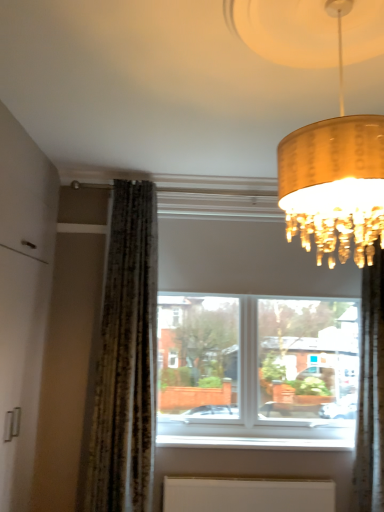
Question: Can you confirm if gold textured lampshade at upper right is taller than white matte radiator at lower center?

Choices:
 (A) yes
 (B) no

Answer: (A)

Question: Can we say gold textured lampshade at upper right lies outside white matte radiator at lower center?

Choices:
 (A) no
 (B) yes

Answer: (B)

Question: Considering the relative positions of gold textured lampshade at upper right and white matte radiator at lower center in the image provided, is gold textured lampshade at upper right to the right of white matte radiator at lower center from the viewer's perspective?

Choices:
 (A) no
 (B) yes

Answer: (A)

Question: Can you confirm if gold textured lampshade at upper right is shorter than white matte radiator at lower center?

Choices:
 (A) yes
 (B) no

Answer: (B)

Question: Does gold textured lampshade at upper right turn towards white matte radiator at lower center?

Choices:
 (A) no
 (B) yes

Answer: (A)

Question: Considering their positions, is white matte radiator at lower center located in front of or behind white smooth window sill at lower center?

Choices:
 (A) behind
 (B) front

Answer: (B)

Question: Which is correct: white matte radiator at lower center is inside white smooth window sill at lower center, or outside of it?

Choices:
 (A) inside
 (B) outside

Answer: (B)

Question: Is point pos(208,482) positioned closer to the camera than point pos(173,436)?

Choices:
 (A) farther
 (B) closer

Answer: (B)

Question: Is white matte radiator at lower center taller or shorter than white smooth window sill at lower center?

Choices:
 (A) short
 (B) tall

Answer: (B)

Question: In the image, is silky green curtain at right positioned in front of or behind transparent glass window at center?

Choices:
 (A) front
 (B) behind

Answer: (A)

Question: Is point (350, 499) positioned closer to the camera than point (238, 312)?

Choices:
 (A) farther
 (B) closer

Answer: (B)

Question: From the image's perspective, is silky green curtain at right positioned above or below transparent glass window at center?

Choices:
 (A) above
 (B) below

Answer: (B)

Question: From a real-world perspective, is silky green curtain at right above or below transparent glass window at center?

Choices:
 (A) below
 (B) above

Answer: (A)

Question: Which is correct: gold textured lampshade at upper right is inside silky green curtain at right, or outside of it?

Choices:
 (A) inside
 (B) outside

Answer: (B)

Question: In terms of size, does gold textured lampshade at upper right appear bigger or smaller than silky green curtain at right?

Choices:
 (A) big
 (B) small

Answer: (A)